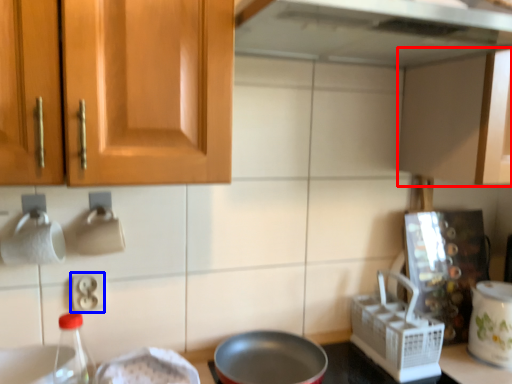
Question: Which object is closer to the camera taking this photo, cabinetry (highlighted by a red box) or electric outlet (highlighted by a blue box)?

Choices:
 (A) cabinetry
 (B) electric outlet

Answer: (A)